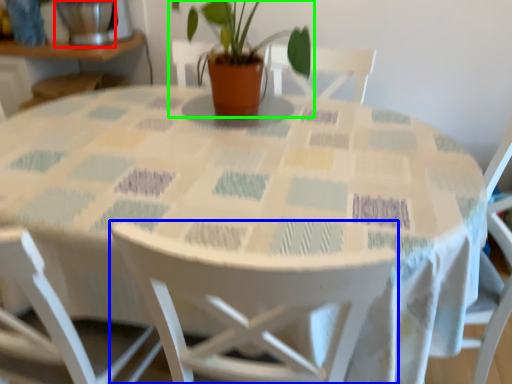
Question: Considering the real-world distances, which object is closest to glass vase (highlighted by a red box)? chair (highlighted by a blue box) or houseplant (highlighted by a green box).

Choices:
 (A) chair
 (B) houseplant

Answer: (B)